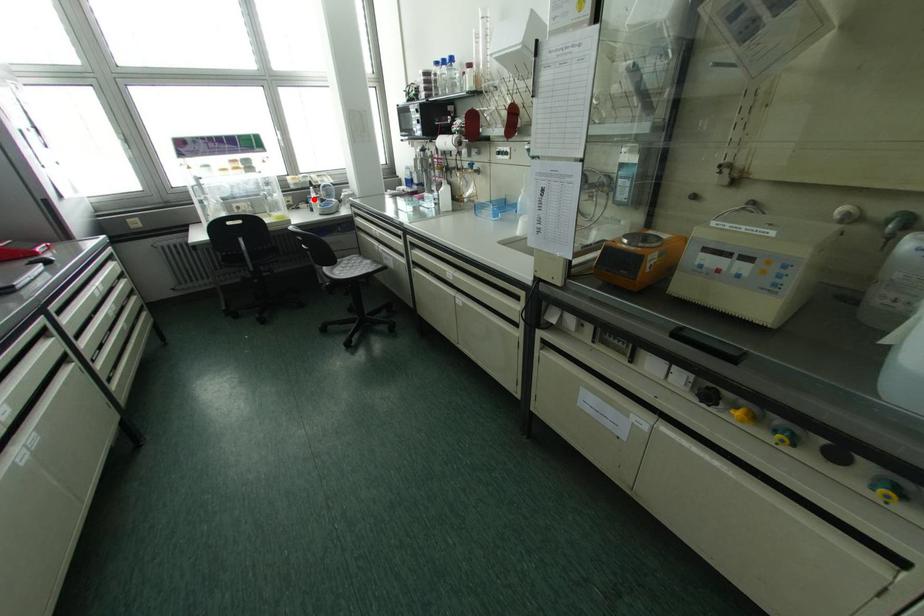
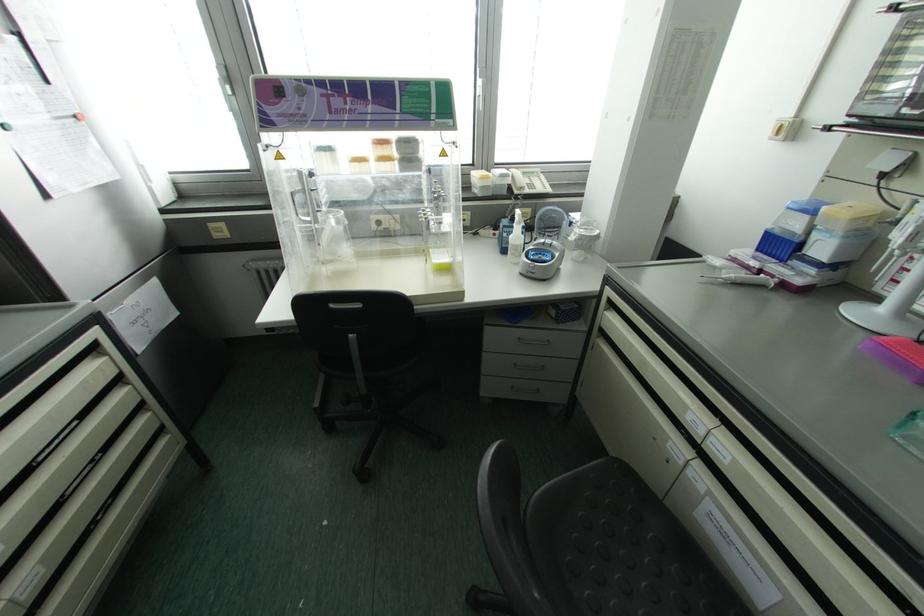
Locate, in the second image, the point that corresponds to the highlighted location in the first image.

(516, 235)